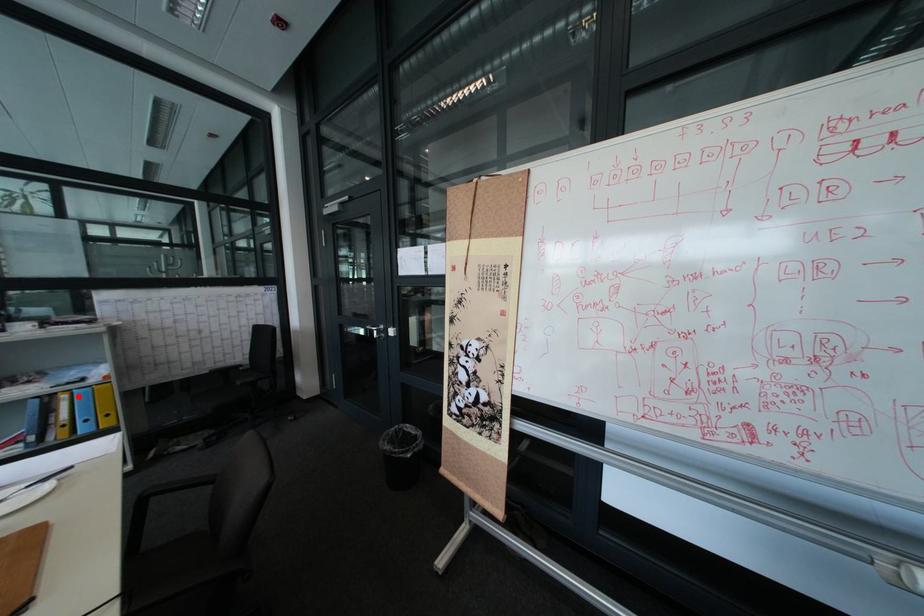
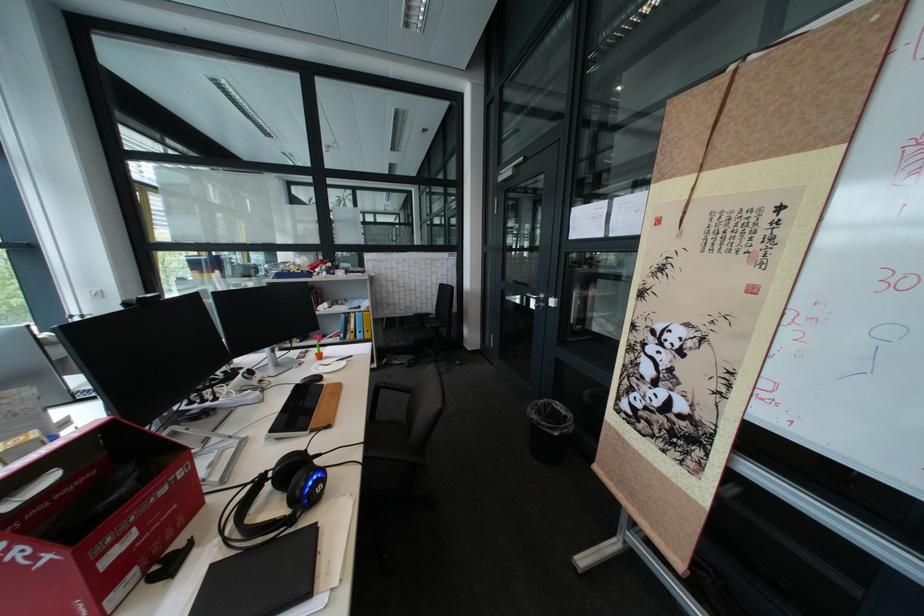
Locate, in the second image, the point that corresponds to the highlighted location in the first image.

(367, 315)